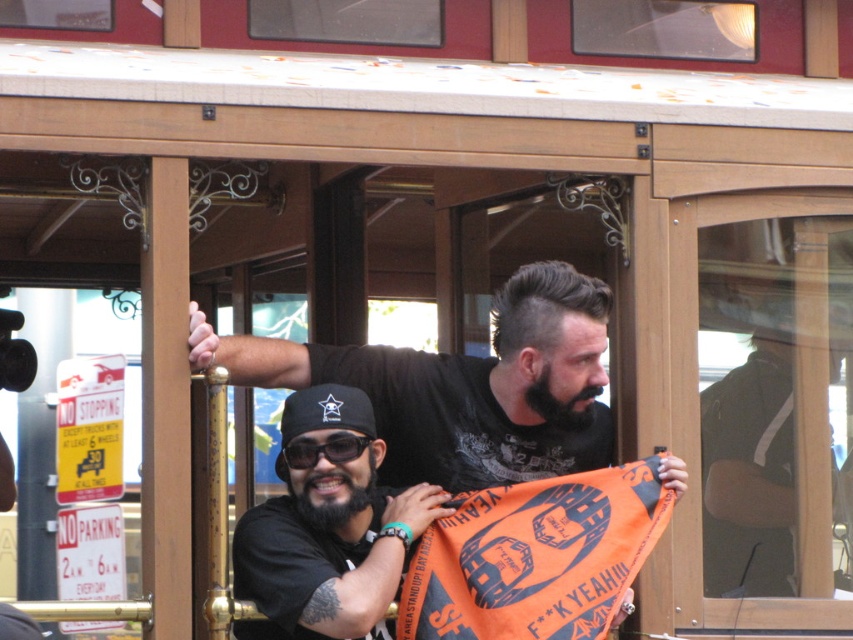
You are a photographer standing outside the trolley car. You want to take a photo of both the black matte shirt at center and the orange fabric flag at center in the same frame. The minimum distance between the objects in the frame must be at least 24 inches to avoid blurring. Will your camera settings allow you to capture both clearly?

The black matte shirt at center and orange fabric flag at center are 24.42 inches apart, which exceeds the minimum required distance of 24 inches. Therefore, the camera settings can capture both clearly without blurring.

You are a photographer trying to capture the scene inside the trolley car. You want to ensure both the black matte shirt at center and the orange fabric flag at center are clearly visible in your photo. Given their sizes, which object should you focus on to ensure both are in frame without needing to adjust your camera angle?

The black matte shirt at center is larger in size than the orange fabric flag at center. To ensure both are in frame, focus on the larger object, the black matte shirt at center, as it will occupy more of the photo and naturally include the smaller orange fabric flag at center within the same shot.

Looking at this image, you are standing at point (218, 506) in the trolley car. What object is located exactly at this point?

The gold polished metal pole at center is located exactly at point (218, 506).